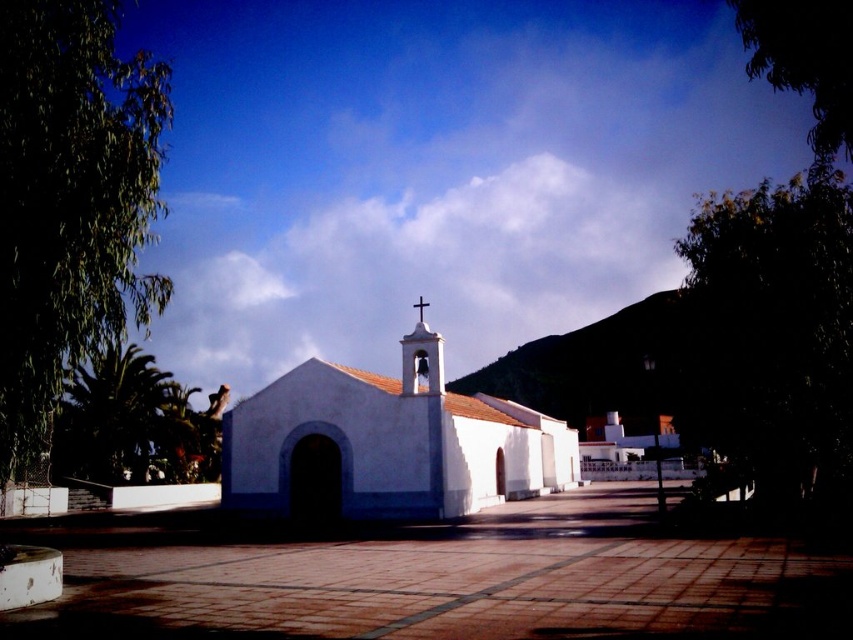
You are standing on the paved plaza in front of the white matte church at center and the white wooden cross at center. You want to place a 12 meter long banner between them. Will the banner be long enough to stretch from one to the other?

The white matte church at center and white wooden cross at center are 10.02 meters apart. Since the banner is 12 meters long, it will be long enough to stretch between them with some extra length remaining.

From the picture: You are standing in front of the white matte church at center and want to place a small flowerpot between it and the white wooden cross at center. Can you do this without moving either object?

The white matte church at center is closer to the viewer than the white wooden cross at center, so there is space between them to place the flowerpot without moving either object.